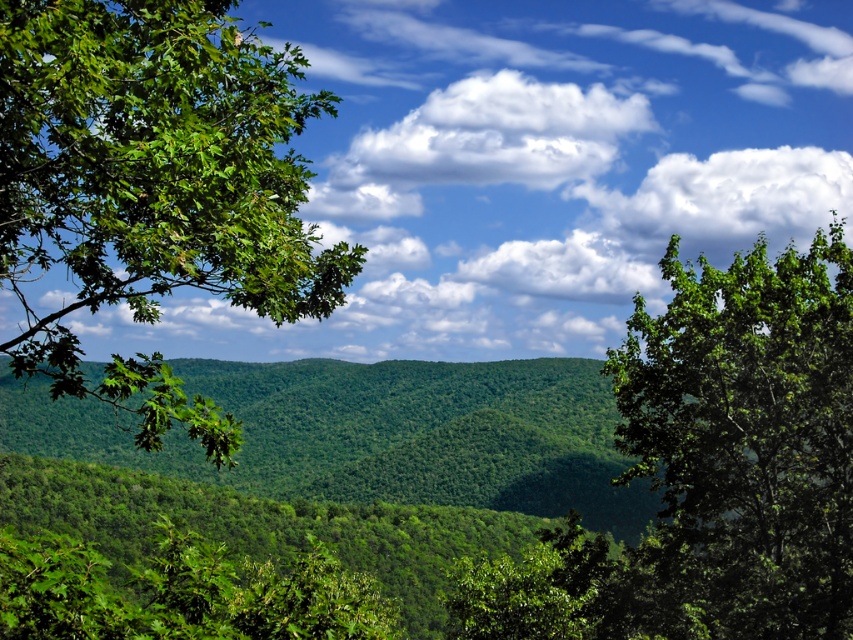
You are an artist sketching this landscape. You want to draw the green leafy branch at left and the white fluffy cloud at upper center. Which object should you sketch first if you follow the left to right drawing order?

You should sketch the green leafy branch at left first because it is positioned to the left of the white fluffy cloud at upper center, following the left to right drawing order.